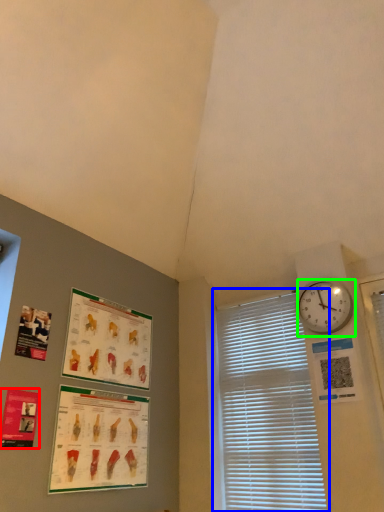
Question: Based on their relative distances, which object is nearer to poster page (highlighted by a red box)? Choose from window blind (highlighted by a blue box) and wall clock (highlighted by a green box).

Choices:
 (A) window blind
 (B) wall clock

Answer: (A)